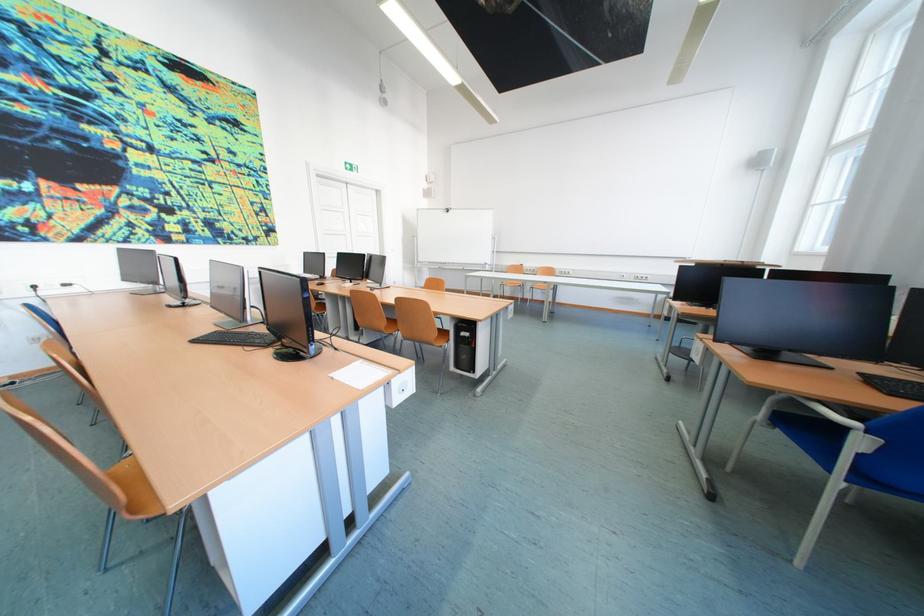
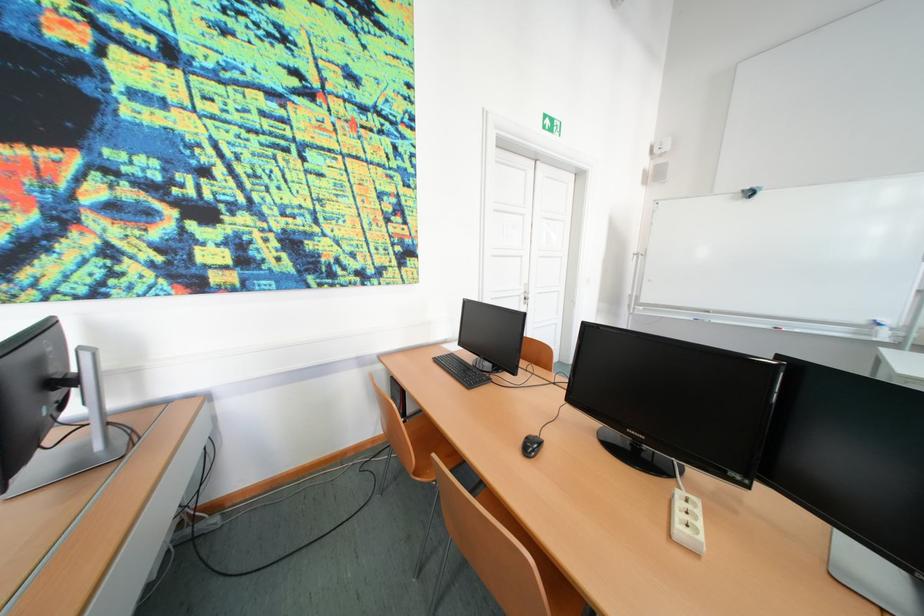
The point at [495,265] is marked in the first image. Where is the corresponding point in the second image?

(874, 323)